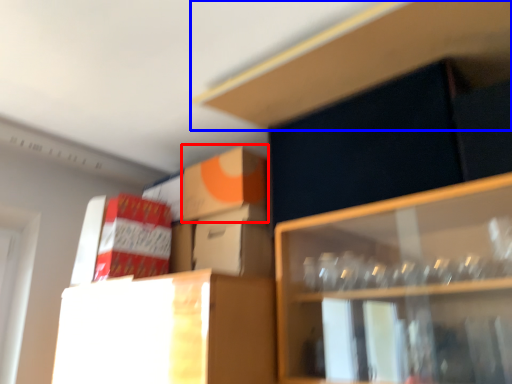
Question: Among these objects, which one is nearest to the camera, cardboard box (highlighted by a red box) or cabinet (highlighted by a blue box)?

Choices:
 (A) cardboard box
 (B) cabinet

Answer: (B)